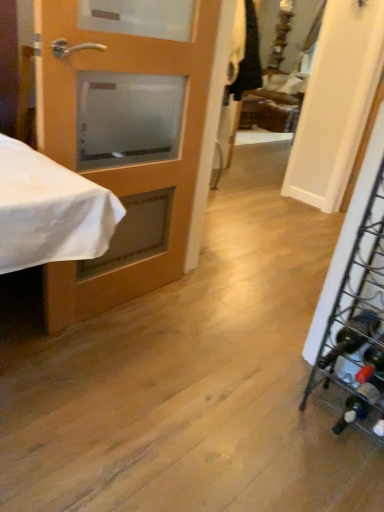
Where is `free space in front of metallic wire wine rack at right`? This screenshot has height=512, width=384. free space in front of metallic wire wine rack at right is located at coordinates [x=340, y=479].